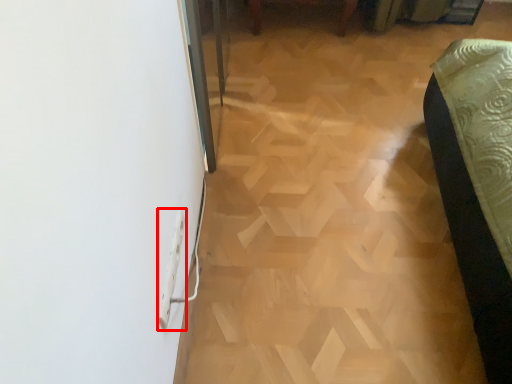
Question: In this image, where is electric outlet (annotated by the red box) located relative to plywood?

Choices:
 (A) left
 (B) right

Answer: (A)